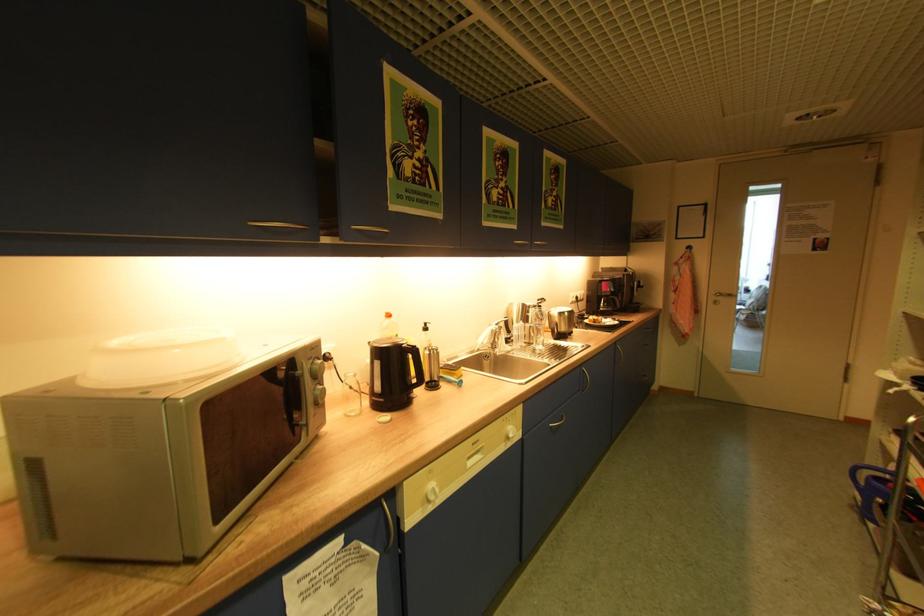
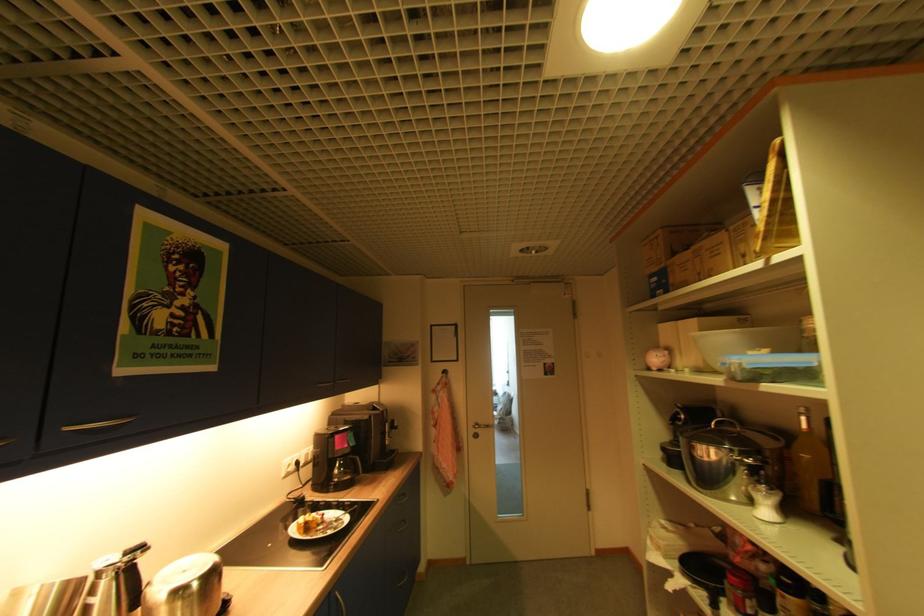
Question: I am providing you with two images of the same scene from different viewpoints. After the viewpoint changes to image2, which objects are now occluded?

Choices:
 (A) plastic food container
 (B) frying pan handle
 (C) white bowl
 (D) none of these

Answer: (D)